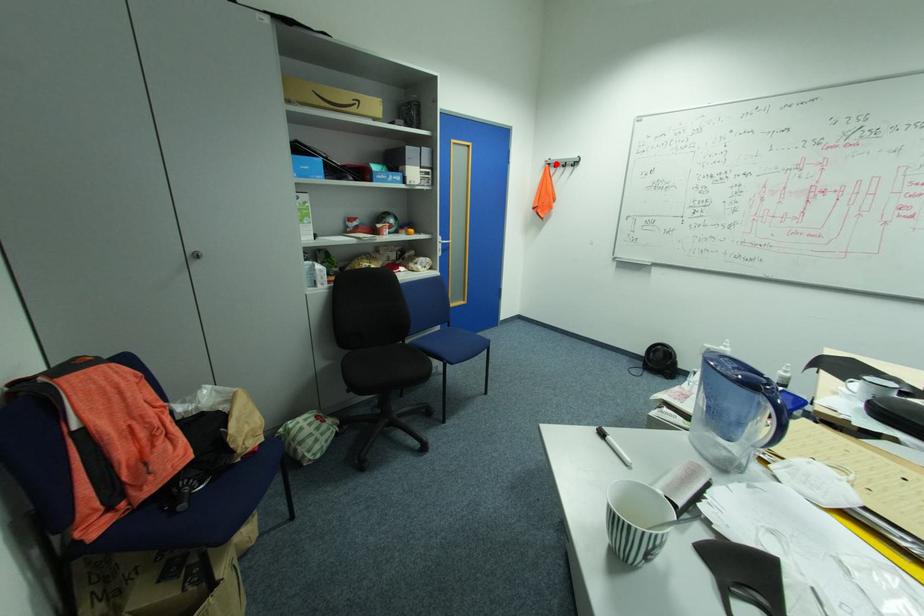
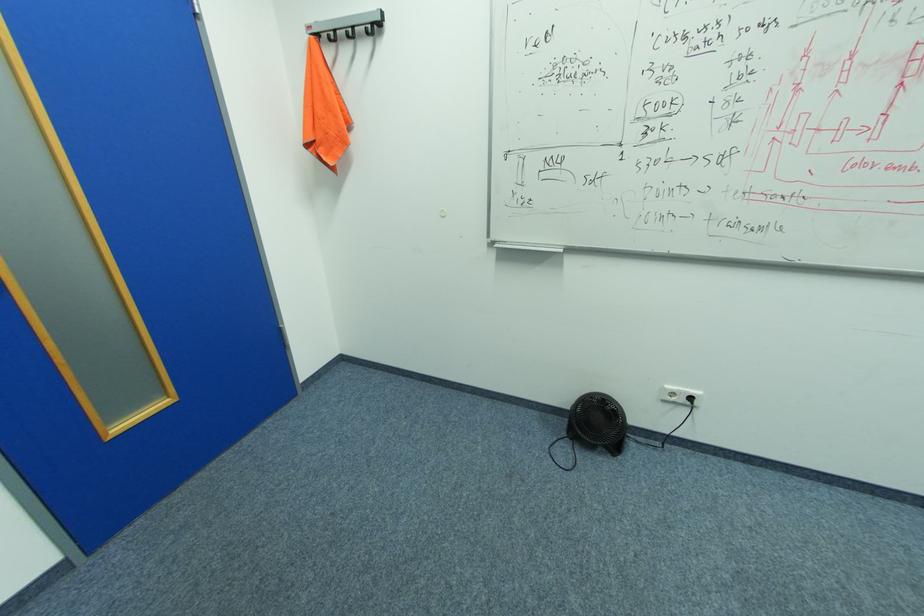
In the second image, find the point that corresponds to the highlighted location in the first image.

(324, 34)